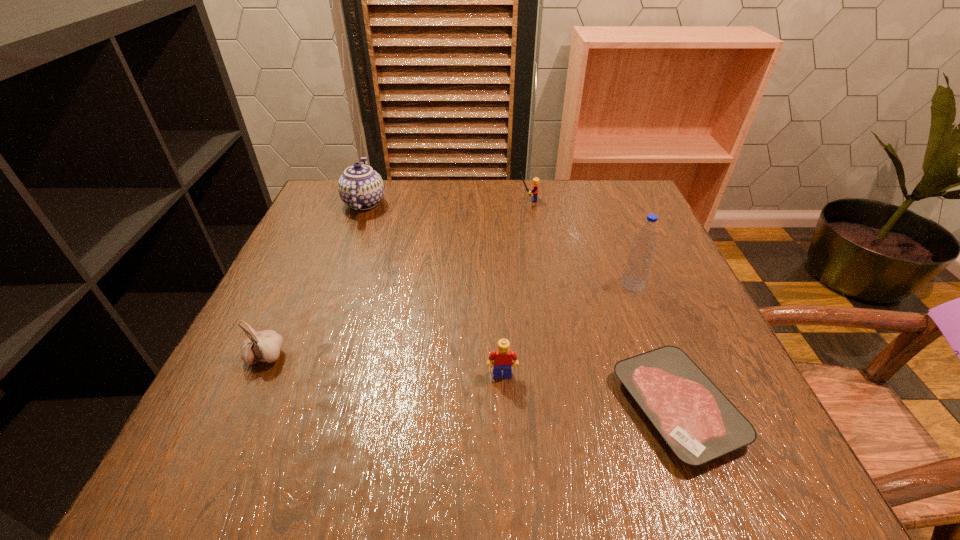
Find the location of a particular element. vacant point that satisfies the following two spatial constraints: 1. on the back side of the shortest object; 2. on the front-facing side of the fourth object from left to right is located at coordinates (597, 200).